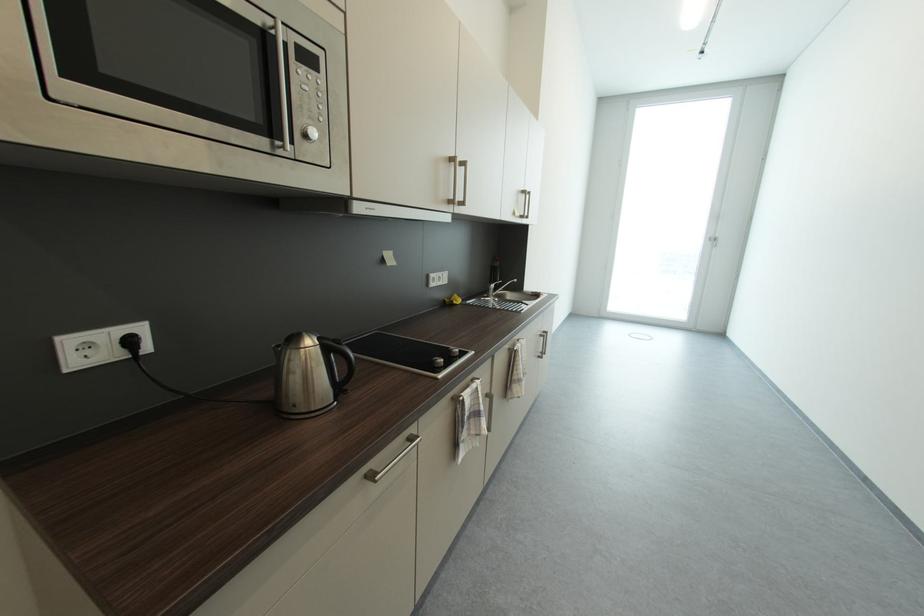
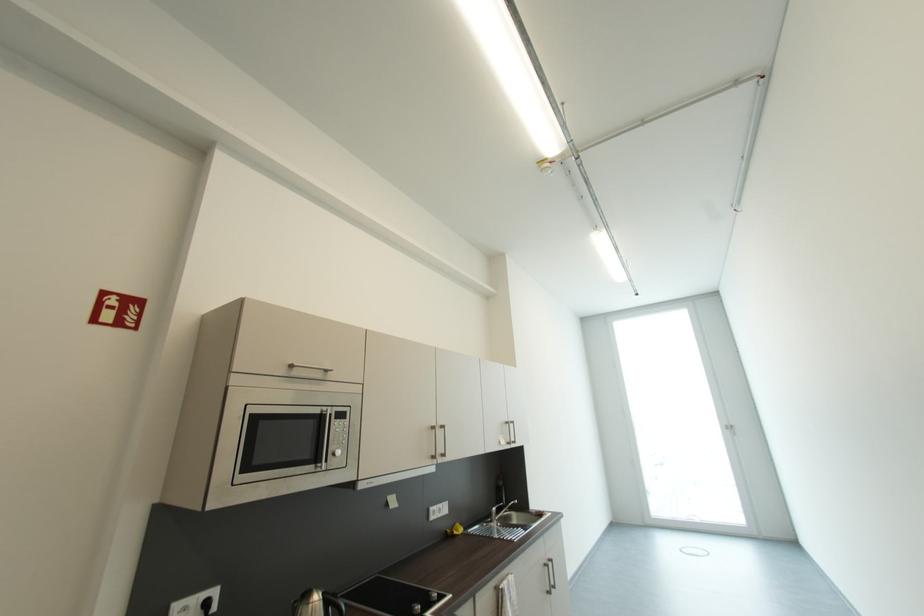
Question: I am providing you with two images of the same scene from different viewpoints. After the viewpoint changes to image2, which objects are now occluded?

Choices:
 (A) black stovetop knob
 (B) white power outlet
 (C) microwave door handle
 (D) none of these

Answer: (D)